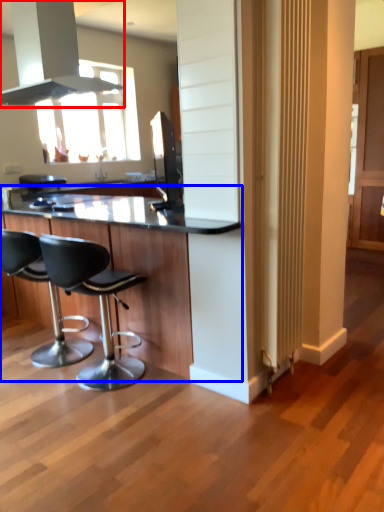
Question: Among these objects, which one is nearest to the camera, exhaust hood (highlighted by a red box) or table (highlighted by a blue box)?

Choices:
 (A) exhaust hood
 (B) table

Answer: (B)